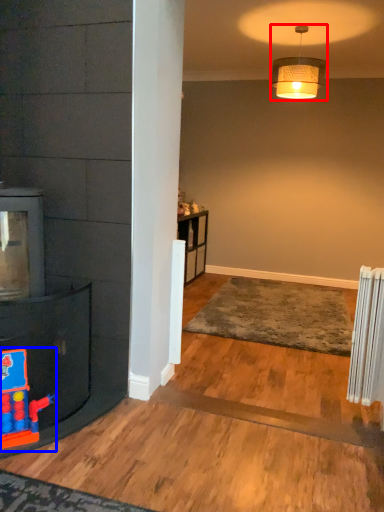
Question: Among these objects, which one is nearest to the camera, lamp (highlighted by a red box) or toy (highlighted by a blue box)?

Choices:
 (A) lamp
 (B) toy

Answer: (B)